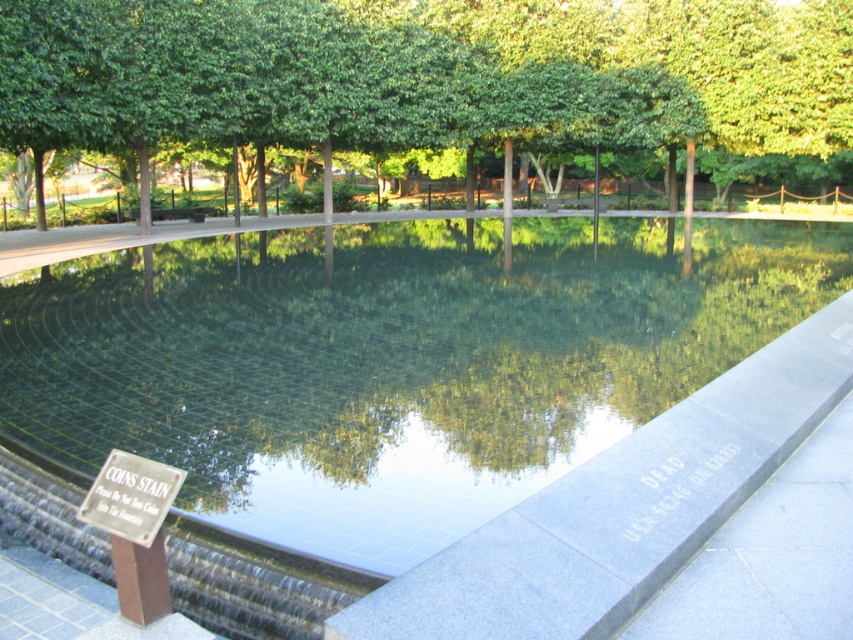
Is clear glass pool at center thinner than green leafy tree at center?

Indeed, clear glass pool at center has a lesser width compared to green leafy tree at center.

Who is positioned more to the right, clear glass pool at center or green leafy tree at center?

Positioned to the right is green leafy tree at center.

Is point (416, 390) positioned after point (474, 70)?

No, (416, 390) is in front of (474, 70).

The image size is (853, 640). In order to click on clear glass pool at center in this screenshot , I will do `click(392, 362)`.

Is clear glass pool at center thinner than metallic silver sign at lower left?

In fact, clear glass pool at center might be wider than metallic silver sign at lower left.

Who is positioned more to the right, clear glass pool at center or metallic silver sign at lower left?

clear glass pool at center

This screenshot has height=640, width=853. Find the location of `clear glass pool at center`. clear glass pool at center is located at coordinates (392, 362).

Is green leafy tree at center below metallic silver sign at lower left?

No, green leafy tree at center is not below metallic silver sign at lower left.

Is point (283, 140) positioned behind point (120, 525)?

Yes, it is behind point (120, 525).

Which is in front, point (305, 141) or point (173, 476)?

Point (173, 476) is more forward.

At what (x,y) coordinates should I click in order to perform the action: click on green leafy tree at center. Please return your answer as a coordinate pair (x, y). Looking at the image, I should click on (426, 74).